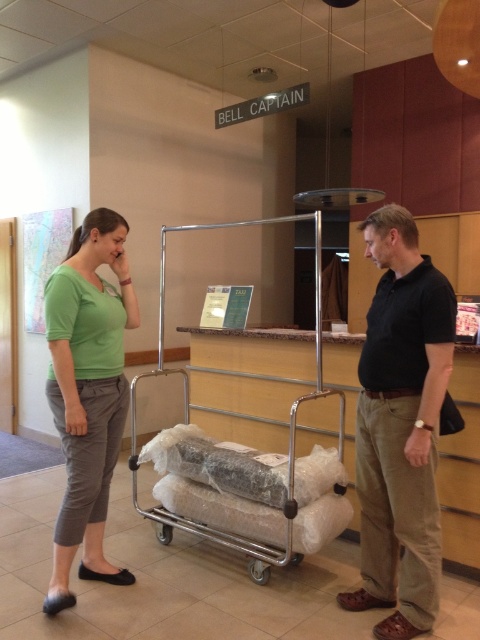
Does point (94, 497) come farther from viewer compared to point (227, 545)?

That is False.

Who is more distant from viewer, (88, 392) or (158, 310)?

Positioned behind is point (158, 310).

This screenshot has width=480, height=640. Find the location of `green matte shirt at left`. green matte shirt at left is located at coordinates (87, 394).

Is black cotton shirt at center smaller than green matte shirt at left?

Correct, black cotton shirt at center occupies less space than green matte shirt at left.

Is black cotton shirt at center bigger than green matte shirt at left?

Actually, black cotton shirt at center might be smaller than green matte shirt at left.

The height and width of the screenshot is (640, 480). What do you see at coordinates (400, 428) in the screenshot? I see `black cotton shirt at center` at bounding box center [400, 428].

Locate an element on the screen. The height and width of the screenshot is (640, 480). black cotton shirt at center is located at coordinates (400, 428).

Is point (412, 305) more distant than point (259, 577)?

No, it is not.

Who is lower down, black cotton shirt at center or silver metallic luggage cart at center?

black cotton shirt at center is below.

Between point (425, 604) and point (269, 556), which one is positioned in front?

Point (425, 604)

Find the location of `black cotton shirt at center`. black cotton shirt at center is located at coordinates (400, 428).